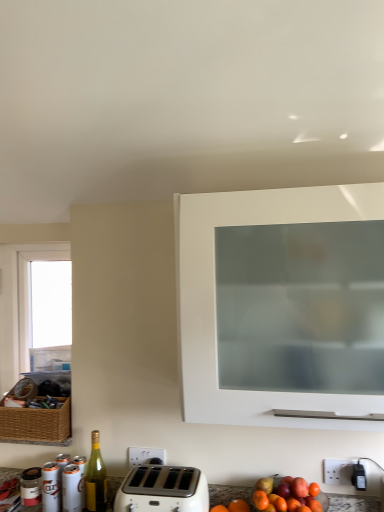
This screenshot has height=512, width=384. Find the location of `green glass bottle at lower left`. green glass bottle at lower left is located at coordinates (96, 478).

You are a GUI agent. You are given a task and a screenshot of the screen. Output one action in this format:
    pyautogui.click(x=<x>, y=<y>)
    Task: Click on the transparent glass window at left
    The height and width of the screenshot is (512, 384).
    Given the screenshot: What is the action you would take?
    pyautogui.click(x=31, y=304)

What do you see at coordinates (163, 490) in the screenshot? The height and width of the screenshot is (512, 384). I see `white plastic toaster at lower center` at bounding box center [163, 490].

This screenshot has width=384, height=512. Identify the location of white glossy cabinet at upper center. (283, 307).

Which is more to the right, green glass bottle at lower left or transparent glass window at left?

green glass bottle at lower left.

Considering the positions of point (90, 481) and point (65, 272), is point (90, 481) closer or farther from the camera than point (65, 272)?

Point (90, 481) appears to be closer to the viewer than point (65, 272).

Is green glass bottle at lower left completely or partially outside of transparent glass window at left?

Yes.

From a real-world perspective, is transparent glass window at left on top of white plastic toaster at lower center?

Indeed, from a real-world perspective, transparent glass window at left stands above white plastic toaster at lower center.

Looking at their sizes, would you say transparent glass window at left is wider or thinner than white plastic toaster at lower center?

Considering their sizes, transparent glass window at left looks slimmer than white plastic toaster at lower center.

Which of these two, transparent glass window at left or white plastic toaster at lower center, is bigger?

white plastic toaster at lower center.

Can you confirm if white glossy cabinet at upper center is shorter than transparent glass window at left?

In fact, white glossy cabinet at upper center may be taller than transparent glass window at left.

Is white glossy cabinet at upper center positioned with its back to transparent glass window at left?

No, transparent glass window at left is not at the back of white glossy cabinet at upper center.

Which point is more distant from viewer, (195, 377) or (64, 254)?

The point (64, 254) is farther from the camera.

In the scene shown: Considering the sizes of objects white glossy cabinet at upper center and transparent glass window at left in the image provided, who is wider, white glossy cabinet at upper center or transparent glass window at left?

Wider between the two is white glossy cabinet at upper center.

From a real-world perspective, who is located higher, white glossy cabinet at upper center or green glass bottle at lower left?

white glossy cabinet at upper center is physically above.

Who is bigger, white glossy cabinet at upper center or green glass bottle at lower left?

With larger size is white glossy cabinet at upper center.

Would you say green glass bottle at lower left is part of white glossy cabinet at upper center's contents?

No, white glossy cabinet at upper center does not contain green glass bottle at lower left.

Considering the relative sizes of white glossy cabinet at upper center and green glass bottle at lower left in the image provided, is white glossy cabinet at upper center thinner than green glass bottle at lower left?

No, white glossy cabinet at upper center is not thinner than green glass bottle at lower left.

How many degrees apart are the facing directions of transparent glass window at left and green glass bottle at lower left?

They differ by 0.228 degrees in their facing directions.

Between transparent glass window at left and green glass bottle at lower left, which one has larger width?

Wider between the two is transparent glass window at left.

From the image's perspective, does transparent glass window at left appear lower than green glass bottle at lower left?

No.

Considering the relative sizes of transparent glass window at left and green glass bottle at lower left in the image provided, is transparent glass window at left bigger than green glass bottle at lower left?

Correct, transparent glass window at left is larger in size than green glass bottle at lower left.

How many degrees apart are the facing directions of white plastic toaster at lower center and transparent glass window at left?

0.228 degrees separate the facing orientations of white plastic toaster at lower center and transparent glass window at left.

Which is more to the left, white plastic toaster at lower center or transparent glass window at left?

transparent glass window at left.

Would you consider white plastic toaster at lower center to be distant from transparent glass window at left?

That's not correct — white plastic toaster at lower center is a little close to transparent glass window at left.

Could you tell me if white plastic toaster at lower center is facing transparent glass window at left?

No, white plastic toaster at lower center is not aimed at transparent glass window at left.

How many degrees apart are the facing directions of green glass bottle at lower left and white plastic toaster at lower center?

0.00307 degrees separate the facing orientations of green glass bottle at lower left and white plastic toaster at lower center.

You are a GUI agent. You are given a task and a screenshot of the screen. Output one action in this format:
    pyautogui.click(x=<x>, y=<y>)
    Task: Click on the toaster below the green glass bottle at lower left (from the image's perspective)
    
    Given the screenshot: What is the action you would take?
    pyautogui.click(x=163, y=490)

Considering the sizes of objects green glass bottle at lower left and white plastic toaster at lower center in the image provided, who is smaller, green glass bottle at lower left or white plastic toaster at lower center?

green glass bottle at lower left is smaller.

Considering the sizes of objects green glass bottle at lower left and white plastic toaster at lower center in the image provided, who is thinner, green glass bottle at lower left or white plastic toaster at lower center?

With smaller width is green glass bottle at lower left.

I want to click on bottle directly beneath the transparent glass window at left (from a real-world perspective), so click(96, 478).

Where is `window that appears behind the white plastic toaster at lower center`? The width and height of the screenshot is (384, 512). window that appears behind the white plastic toaster at lower center is located at coordinates (31, 304).

From the picture: Looking at the image, which one is located closer to green glass bottle at lower left, white glossy cabinet at upper center or transparent glass window at left?

transparent glass window at left is closer to green glass bottle at lower left.

Looking at the image, which one is located closer to green glass bottle at lower left, white glossy cabinet at upper center or white plastic toaster at lower center?

The object closer to green glass bottle at lower left is white plastic toaster at lower center.

Based on their spatial positions, is white glossy cabinet at upper center or white plastic toaster at lower center further from transparent glass window at left?

Among the two, white glossy cabinet at upper center is located further to transparent glass window at left.

Based on the photo, looking at the image, which one is located closer to white glossy cabinet at upper center, white plastic toaster at lower center or green glass bottle at lower left?

The object closer to white glossy cabinet at upper center is white plastic toaster at lower center.

Considering their positions, is green glass bottle at lower left positioned closer to transparent glass window at left than white plastic toaster at lower center?

green glass bottle at lower left.

Based on their spatial positions, is transparent glass window at left or green glass bottle at lower left further from white plastic toaster at lower center?

Among the two, transparent glass window at left is located further to white plastic toaster at lower center.

Estimate the real-world distances between objects in this image. Which object is further from white plastic toaster at lower center, white glossy cabinet at upper center or green glass bottle at lower left?

Based on the image, white glossy cabinet at upper center appears to be further to white plastic toaster at lower center.

Based on their spatial positions, is white plastic toaster at lower center or white glossy cabinet at upper center further from green glass bottle at lower left?

Among the two, white glossy cabinet at upper center is located further to green glass bottle at lower left.

Find the location of a particular element. The image size is (384, 512). toaster between transparent glass window at left and white glossy cabinet at upper center from left to right is located at coordinates (x=163, y=490).

This screenshot has width=384, height=512. I want to click on bottle between white glossy cabinet at upper center and white plastic toaster at lower center in the up-down direction, so click(x=96, y=478).

At what (x,y) coordinates should I click in order to perform the action: click on bottle between transparent glass window at left and white glossy cabinet at upper center from left to right. Please return your answer as a coordinate pair (x, y). Looking at the image, I should click on (96, 478).

Find the location of a particular element. The height and width of the screenshot is (512, 384). bottle between transparent glass window at left and white plastic toaster at lower center from top to bottom is located at coordinates (96, 478).